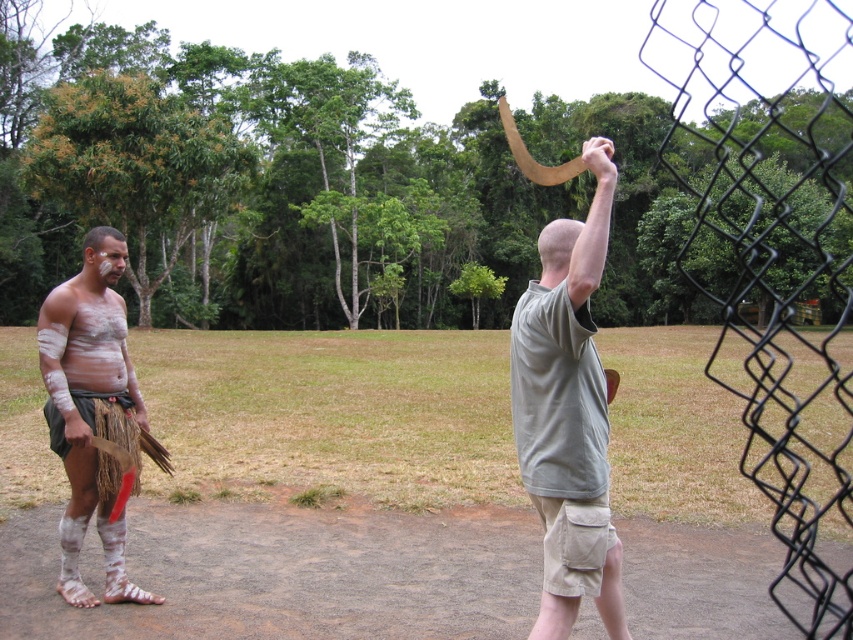
Question: Does black wire mesh fence at right come in front of matte white skin at left?

Choices:
 (A) no
 (B) yes

Answer: (B)

Question: Which of the following is the closest to the observer?

Choices:
 (A) matte white skin at left
 (B) matte brown horn at upper right

Answer: (B)

Question: Where is black wire mesh fence at right located in relation to matte white skin at left in the image?

Choices:
 (A) right
 (B) left

Answer: (A)

Question: Among these points, which one is farthest from the camera?

Choices:
 (A) (817, 109)
 (B) (102, 500)

Answer: (A)

Question: Where is matte brown horn at upper right located in relation to matte white skin at left in the image?

Choices:
 (A) below
 (B) above

Answer: (A)

Question: Estimate the real-world distances between objects in this image. Which object is farther from the black wire mesh fence at right?

Choices:
 (A) matte brown horn at upper right
 (B) matte white skin at left

Answer: (B)